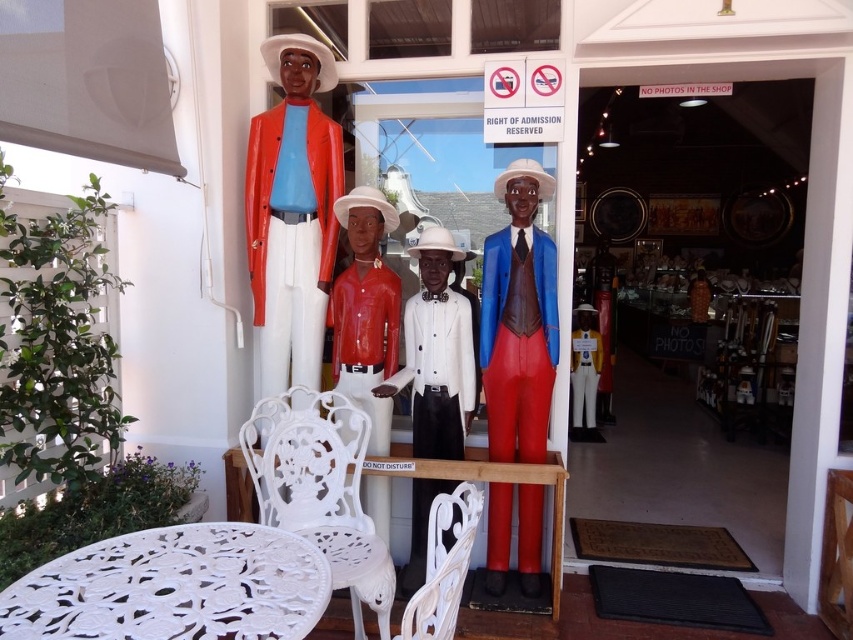
Can you confirm if white cast iron chair at lower left is positioned below white wrought iron chair at lower center?

Indeed, white cast iron chair at lower left is positioned under white wrought iron chair at lower center.

Based on the photo, between white cast iron chair at lower left and white wrought iron chair at lower center, which one has more height?

Standing taller between the two is white cast iron chair at lower left.

Does point (346, 525) come closer to viewer compared to point (457, 522)?

No, (346, 525) is behind (457, 522).

Where is `white cast iron chair at lower left`? The width and height of the screenshot is (853, 640). white cast iron chair at lower left is located at coordinates (320, 490).

Does white glossy suit at center appear on the left side of matte yellow fabric figurine at center?

Correct, you'll find white glossy suit at center to the left of matte yellow fabric figurine at center.

Which is more to the left, white glossy suit at center or matte yellow fabric figurine at center?

Positioned to the left is white glossy suit at center.

Between point (450, 256) and point (590, 332), which one is positioned behind?

The point (590, 332) is behind.

Find the location of a particular element. The width and height of the screenshot is (853, 640). white glossy suit at center is located at coordinates (436, 353).

Who is more forward, (254, 477) or (427, 401)?

Positioned in front is point (254, 477).

Consider the image. Who is shorter, white cast iron chair at lower left or white glossy suit at center?

white cast iron chair at lower left is shorter.

Who is more forward, (260, 410) or (442, 480)?

Point (260, 410)

Identify the location of white cast iron chair at lower left. (320, 490).